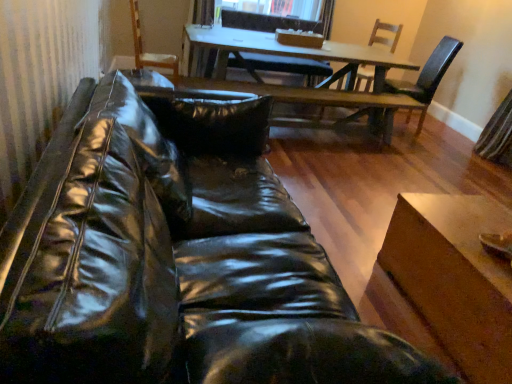
Question: Looking at their shapes, would you say glossy leather couch at lower left is wider or thinner than wooden chair at upper center, placed as the third chair when sorted from right to left?

Choices:
 (A) thin
 (B) wide

Answer: (B)

Question: From a real-world perspective, is glossy leather couch at lower left above or below wooden chair at upper center, the 1th chair when ordered from left to right?

Choices:
 (A) above
 (B) below

Answer: (B)

Question: Which object is the closest to the wooden armchair at upper center?

Choices:
 (A) glossy leather couch at lower left
 (B) wooden table at center, the first table when ordered from top to bottom
 (C) wooden chair at upper right, arranged as the second chair when viewed from the right
 (D) wooden chair at upper center, placed as the third chair when sorted from right to left
 (E) matte black chair at upper right, the 3th chair from the left

Answer: (D)

Question: Which object is positioned farthest from the wooden chair at upper right, arranged as the second chair when viewed from the right?

Choices:
 (A) wooden chair at upper center, the 1th chair when ordered from left to right
 (B) wooden table at center, placed as the first table when sorted from back to front
 (C) glossy leather couch at lower left
 (D) wooden armchair at upper center
 (E) wooden table at lower right, which is the second table in back-to-front order

Answer: (C)